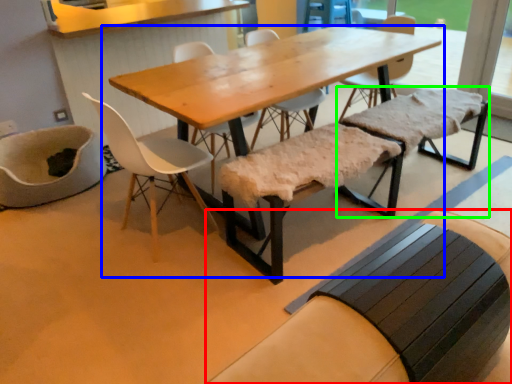
Question: Based on their relative distances, which object is farther from church bench (highlighted by a red box)? Choose from table (highlighted by a blue box) and church bench (highlighted by a green box).

Choices:
 (A) table
 (B) church bench

Answer: (B)